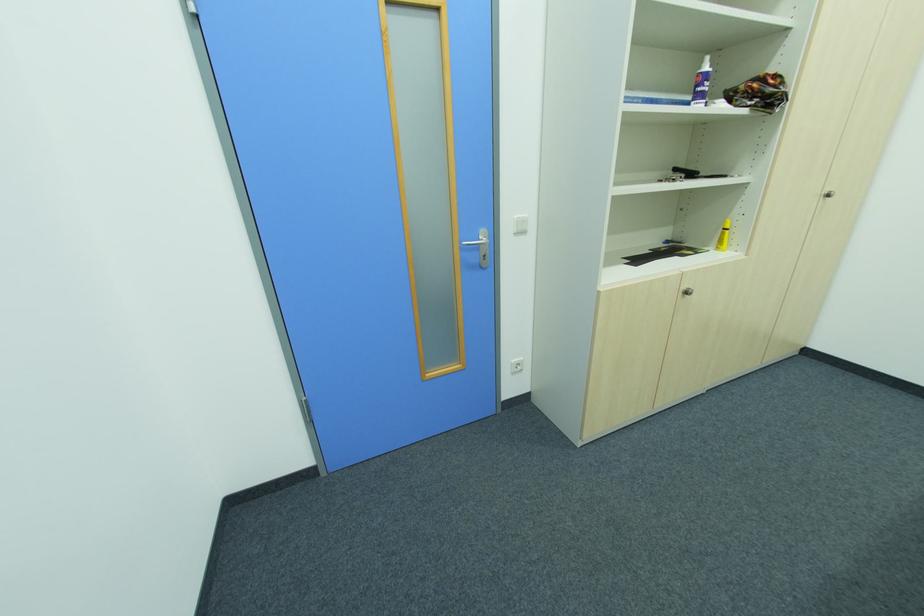
Find where to push the white light switch. Please return your answer as a coordinate pair (x, y).

(520, 225)